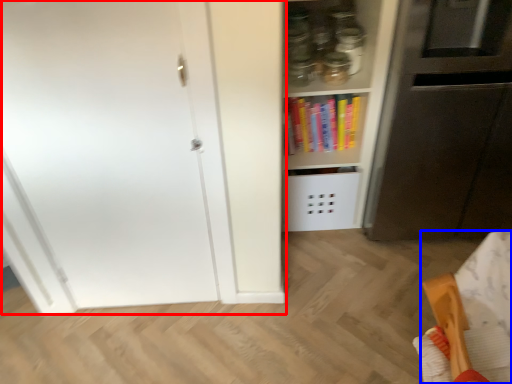
Question: Which object is closer to the camera taking this photo, door (highlighted by a red box) or furniture (highlighted by a blue box)?

Choices:
 (A) door
 (B) furniture

Answer: (B)